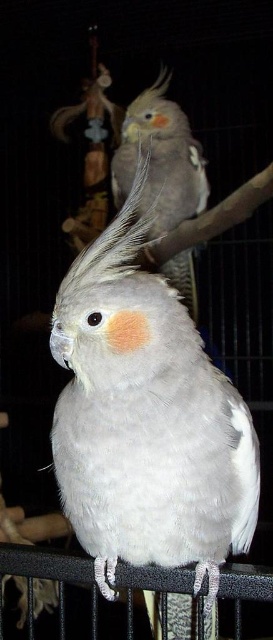
You are a bird keeper who needs to place a food bowl between the white feathered parrot at center and the gray feathered parrot at upper center. The bowl has a diameter of 30 cm. Can you fit the bowl between them without moving the birds?

The distance between the white feathered parrot at center and the gray feathered parrot at upper center is 1.53 meters, which is 153 cm. Since the bowl requires only 30 cm of space, there is sufficient room to place it between them without moving the birds.

In the scene shown: You are a bird enthusiast observing the two parrots in the cage. Which parrot, the white feathered parrot at center or the gray feathered parrot at upper center, is wider?

The white feathered parrot at center has a lesser width compared to gray feathered parrot at upper center, so the gray feathered parrot at upper center is wider.